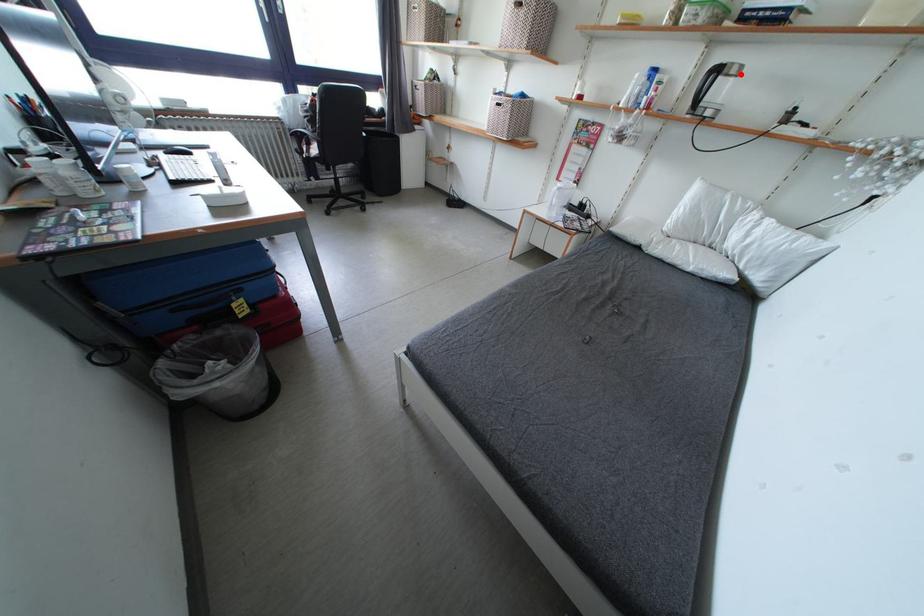
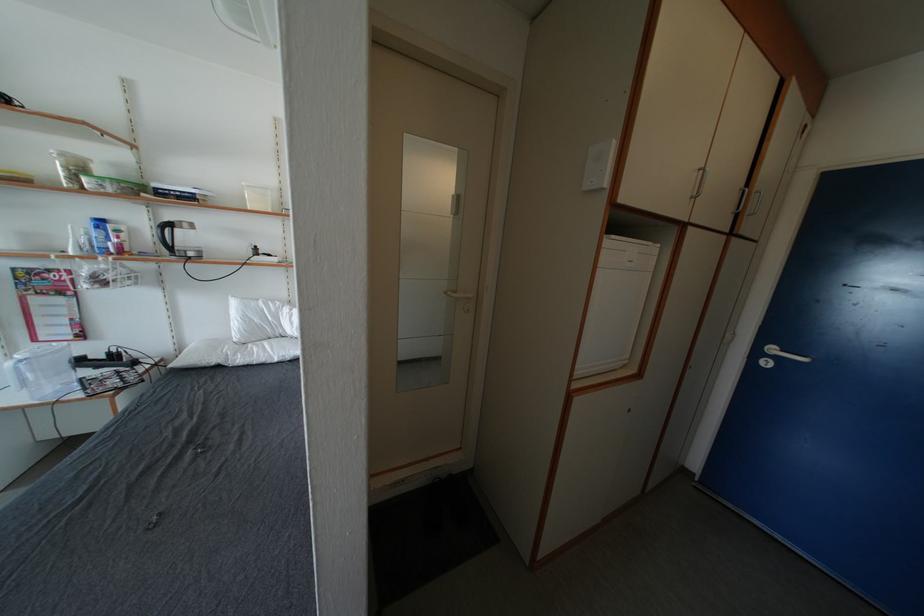
Question: I am providing you with two images of the same scene from different viewpoints. A red point is marked on the first image. At the location where the point appears in image 1, is it still visible in image 2?

Choices:
 (A) Yes
 (B) No

Answer: (A)